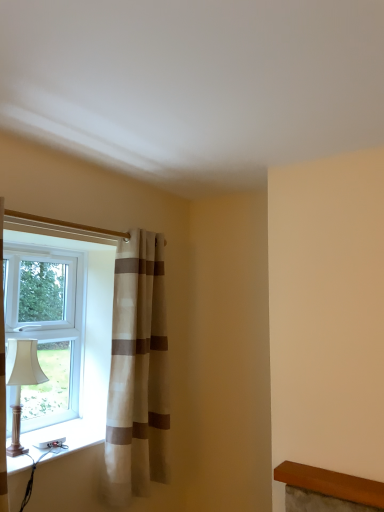
Question: Is white plastic window sill at lower left to the left of beige striped curtain at left from the viewer's perspective?

Choices:
 (A) yes
 (B) no

Answer: (A)

Question: Is white plastic window sill at lower left smaller than beige striped curtain at left?

Choices:
 (A) yes
 (B) no

Answer: (A)

Question: From a real-world perspective, is white plastic window sill at lower left below beige striped curtain at left?

Choices:
 (A) no
 (B) yes

Answer: (B)

Question: Would you say white plastic window sill at lower left contains beige striped curtain at left?

Choices:
 (A) yes
 (B) no

Answer: (B)

Question: From a real-world perspective, is white plastic window sill at lower left on top of beige striped curtain at left?

Choices:
 (A) no
 (B) yes

Answer: (A)

Question: Relative to beige striped curtain at left, is white plastic window at left in front or behind?

Choices:
 (A) behind
 (B) front

Answer: (A)

Question: Considering the positions of white plastic window at left and beige striped curtain at left in the image, is white plastic window at left wider or thinner than beige striped curtain at left?

Choices:
 (A) wide
 (B) thin

Answer: (B)

Question: In terms of height, does white plastic window at left look taller or shorter compared to beige striped curtain at left?

Choices:
 (A) tall
 (B) short

Answer: (B)

Question: Is white plastic window at left to the left or to the right of beige striped curtain at left in the image?

Choices:
 (A) left
 (B) right

Answer: (A)

Question: In the image, is matte white lampshade at left on the left side or the right side of white plastic window at left?

Choices:
 (A) left
 (B) right

Answer: (B)

Question: From a real-world perspective, relative to white plastic window at left, is matte white lampshade at left vertically above or below?

Choices:
 (A) above
 (B) below

Answer: (B)

Question: Is matte white lampshade at left inside the boundaries of white plastic window at left, or outside?

Choices:
 (A) inside
 (B) outside

Answer: (B)

Question: In the image, is matte white lampshade at left positioned in front of or behind white plastic window at left?

Choices:
 (A) front
 (B) behind

Answer: (A)

Question: From the image's perspective, is matte white lampshade at left above or below beige striped curtain at left?

Choices:
 (A) below
 (B) above

Answer: (A)

Question: Considering the positions of matte white lampshade at left and beige striped curtain at left in the image, is matte white lampshade at left taller or shorter than beige striped curtain at left?

Choices:
 (A) tall
 (B) short

Answer: (B)